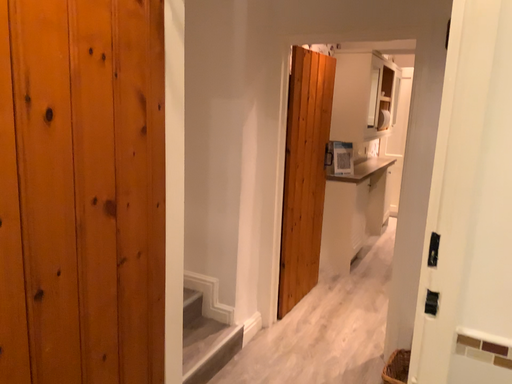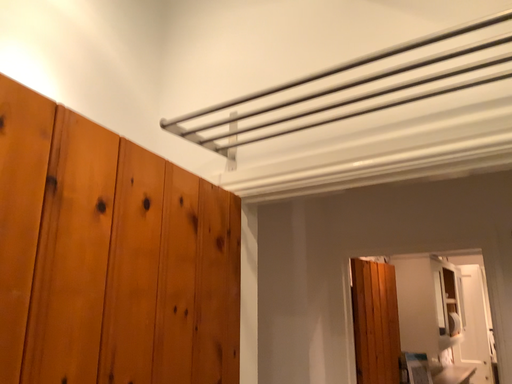
Question: How did the camera likely rotate when shooting the video?

Choices:
 (A) rotated downward
 (B) rotated upward

Answer: (B)